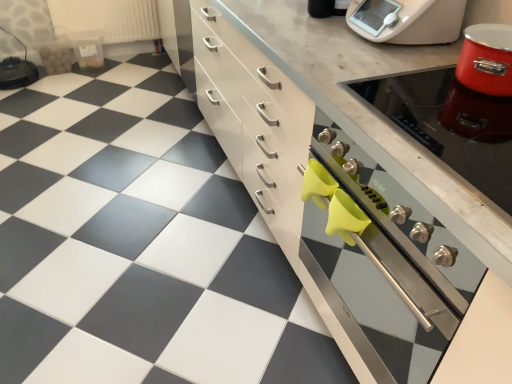
In order to face white plastic food processor at upper right, should I rotate leftwards or rightwards?

A 19.275 degree turn to the right will do.

What do you see at coordinates (389, 250) in the screenshot? I see `metallic silver oven at right` at bounding box center [389, 250].

Image resolution: width=512 pixels, height=384 pixels. Find the location of `white plastic radiator at upper left`. white plastic radiator at upper left is located at coordinates (106, 19).

Image resolution: width=512 pixels, height=384 pixels. Find the location of `matte white cabinet at center`. matte white cabinet at center is located at coordinates (356, 174).

This screenshot has width=512, height=384. I want to click on white plastic food processor at upper right, so click(407, 20).

Can you see metallic silver oven at right touching matte white cabinet at center?

There is a gap between metallic silver oven at right and matte white cabinet at center.

Can you tell me how much metallic silver oven at right and matte white cabinet at center differ in facing direction?

The angular difference between metallic silver oven at right and matte white cabinet at center is 0.293 degrees.

Between metallic silver oven at right and matte white cabinet at center, which one has smaller width?

metallic silver oven at right is thinner.

Between point (310, 172) and point (404, 375), which one is positioned behind?

The point (310, 172) is farther.

Is shiny metallic stove at upper right with white plastic food processor at upper right?

They are not placed beside each other.

Consider the image. From the image's perspective, which one is positioned lower, shiny metallic stove at upper right or white plastic food processor at upper right?

shiny metallic stove at upper right, from the image's perspective.

From a real-world perspective, who is located higher, shiny metallic stove at upper right or white plastic food processor at upper right?

white plastic food processor at upper right is physically above.

The image size is (512, 384). Find the location of `radiator beneath the white plastic food processor at upper right (from a real-world perspective)`. radiator beneath the white plastic food processor at upper right (from a real-world perspective) is located at coordinates (106, 19).

Consider the image. From a real-world perspective, is white plastic radiator at upper left over white plastic food processor at upper right?

No.

Between point (112, 0) and point (398, 17), which one is positioned behind?

The point (112, 0) is behind.

From a real-world perspective, which is physically below, metallic silver oven at right or white plastic food processor at upper right?

metallic silver oven at right.

Between metallic silver oven at right and white plastic food processor at upper right, which one has smaller width?

Thinner between the two is white plastic food processor at upper right.

Is metallic silver oven at right smaller than white plastic food processor at upper right?

Actually, metallic silver oven at right might be larger than white plastic food processor at upper right.

Considering the positions of objects metallic silver oven at right and white plastic food processor at upper right in the image provided, who is more to the left, metallic silver oven at right or white plastic food processor at upper right?

white plastic food processor at upper right is more to the left.

From the image's perspective, between metallic silver oven at right and shiny metallic stove at upper right, who is located below?

From the image's view, metallic silver oven at right is below.

Which of these two, metallic silver oven at right or shiny metallic stove at upper right, stands shorter?

shiny metallic stove at upper right.

Locate an element on the screen. oven on the right of shiny metallic stove at upper right is located at coordinates (389, 250).

Is metallic silver oven at right oriented away from shiny metallic stove at upper right?

No, metallic silver oven at right is not facing away from shiny metallic stove at upper right.

From the image's perspective, would you say matte white cabinet at center is shown under shiny metallic stove at upper right?

Actually, matte white cabinet at center appears above shiny metallic stove at upper right in the image.

Is matte white cabinet at center to the left of shiny metallic stove at upper right from the viewer's perspective?

Correct, you'll find matte white cabinet at center to the left of shiny metallic stove at upper right.

From a real-world perspective, does matte white cabinet at center stand above shiny metallic stove at upper right?

No, from a real-world perspective, matte white cabinet at center is not above shiny metallic stove at upper right.

In the scene shown: Are matte white cabinet at center and shiny metallic stove at upper right far apart?

No, matte white cabinet at center is not far from shiny metallic stove at upper right.

Is white plastic food processor at upper right inside the boundaries of white plastic radiator at upper left, or outside?

white plastic food processor at upper right is located beyond the bounds of white plastic radiator at upper left.

Based on the photo, from the image's perspective, would you say white plastic food processor at upper right is shown under white plastic radiator at upper left?

Yes, from the image's perspective, white plastic food processor at upper right is below white plastic radiator at upper left.

How many degrees apart are the facing directions of white plastic food processor at upper right and white plastic radiator at upper left?

The facing directions of white plastic food processor at upper right and white plastic radiator at upper left are 93 degrees apart.

Considering the sizes of objects white plastic food processor at upper right and white plastic radiator at upper left in the image provided, who is taller, white plastic food processor at upper right or white plastic radiator at upper left?

white plastic radiator at upper left.

You are a GUI agent. You are given a task and a screenshot of the screen. Output one action in this format:
    pyautogui.click(x=<x>, y=<y>)
    Task: Click on the oven lying on the right of matte white cabinet at center
    The image size is (512, 384).
    Given the screenshot: What is the action you would take?
    pyautogui.click(x=389, y=250)

Find the location of a particular element. The height and width of the screenshot is (384, 512). home appliance that is on the left side of shiny metallic stove at upper right is located at coordinates (407, 20).

From the image, which object appears to be nearer to metallic silver oven at right, white plastic food processor at upper right or white plastic radiator at upper left?

Based on the image, white plastic food processor at upper right appears to be nearer to metallic silver oven at right.

From the image, which object appears to be nearer to shiny metallic stove at upper right, matte white cabinet at center or metallic silver oven at right?

Among the two, matte white cabinet at center is located nearer to shiny metallic stove at upper right.

Looking at the image, which one is located closer to white plastic food processor at upper right, metallic silver oven at right or matte white cabinet at center?

Based on the image, matte white cabinet at center appears to be nearer to white plastic food processor at upper right.

Estimate the real-world distances between objects in this image. Which object is further from white plastic radiator at upper left, matte white cabinet at center or white plastic food processor at upper right?

white plastic food processor at upper right lies further to white plastic radiator at upper left than the other object.

Looking at the image, which one is located further to matte white cabinet at center, metallic silver oven at right or shiny metallic stove at upper right?

Among the two, shiny metallic stove at upper right is located further to matte white cabinet at center.

Looking at the image, which one is located further to shiny metallic stove at upper right, matte white cabinet at center or white plastic food processor at upper right?

white plastic food processor at upper right is positioned further to the anchor shiny metallic stove at upper right.

Based on their spatial positions, is shiny metallic stove at upper right or metallic silver oven at right further from matte white cabinet at center?

shiny metallic stove at upper right is further to matte white cabinet at center.

Considering their positions, is shiny metallic stove at upper right positioned closer to white plastic radiator at upper left than matte white cabinet at center?

matte white cabinet at center lies closer to white plastic radiator at upper left than the other object.

Identify the location of home appliance between metallic silver oven at right and white plastic radiator at upper left from front to back. (407, 20).

Locate an element on the screen. appliance between white plastic food processor at upper right and metallic silver oven at right vertically is located at coordinates (451, 128).

You are a GUI agent. You are given a task and a screenshot of the screen. Output one action in this format:
    pyautogui.click(x=<x>, y=<y>)
    Task: Click on the cabinetry between white plastic food processor at upper right and metallic silver oven at right from top to bottom
    
    Given the screenshot: What is the action you would take?
    click(356, 174)

At what (x,y) coordinates should I click in order to perform the action: click on appliance between matte white cabinet at center and white plastic food processor at upper right from front to back. Please return your answer as a coordinate pair (x, y). Looking at the image, I should click on (451, 128).